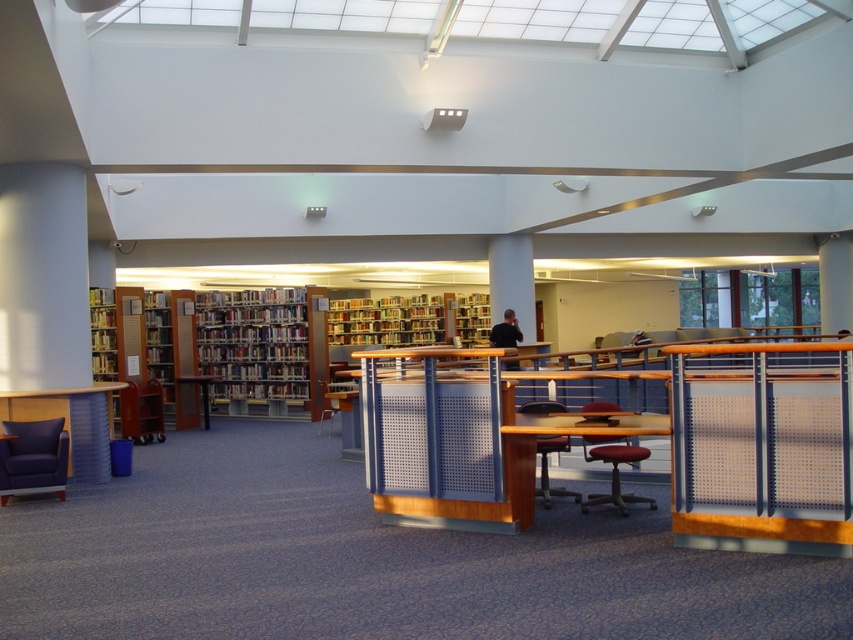
You are a student trying to find a seat in the library. You see the dark blue fabric swivel chair at lower left and the red leather office chair at center. Which chair is closer to you?

The dark blue fabric swivel chair at lower left is closer to you because it is further to the viewer than the red leather office chair at center.

Based on the photo, you are a student who needs to choose between the dark blue fabric swivel chair at lower left and the red leather office chair at center for a long study session. Which chair would be more comfortable based on their sizes?

The red leather office chair at center is thicker than the dark blue fabric swivel chair at lower left, so it might provide more cushioning and support, making it more comfortable for a long study session.

You are a student who needs to reach a book on the wooden bookshelf at center. You see the dark blue fabric swivel chair at lower left nearby. Can you use the chair to stand on to reach the book?

The wooden bookshelf at center is located above the dark blue fabric swivel chair at lower left, so the chair is positioned below the bookshelf. Since the chair is at a lower level, you can stand on it to reach the book on the wooden bookshelf at center.